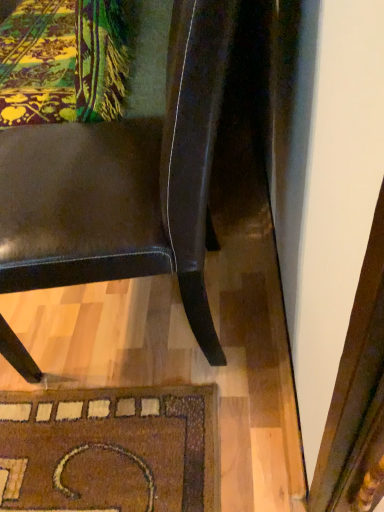
Measure the distance between leather chair at lower left and camera.

leather chair at lower left and camera are 18.92 inches apart from each other.

Describe the element at coordinates (124, 159) in the screenshot. I see `leather chair at lower left` at that location.

Where is `leather chair at lower left`? The image size is (384, 512). leather chair at lower left is located at coordinates (124, 159).

I want to click on leather chair at lower left, so pyautogui.click(x=124, y=159).